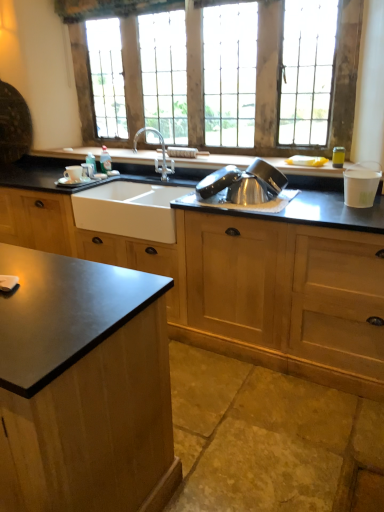
Question: Is matte white cup at sink far away from satin silver bowl at center, acting as the 2th appliance starting from the right?

Choices:
 (A) no
 (B) yes

Answer: (B)

Question: Considering the relative positions of matte white cup at sink and satin silver bowl at center, marked as the first appliance in a left-to-right arrangement, in the image provided, is matte white cup at sink to the left of satin silver bowl at center, marked as the first appliance in a left-to-right arrangement, from the viewer's perspective?

Choices:
 (A) no
 (B) yes

Answer: (B)

Question: From a real-world perspective, is matte white cup at sink beneath satin silver bowl at center, marked as the first appliance in a left-to-right arrangement?

Choices:
 (A) no
 (B) yes

Answer: (B)

Question: Is satin silver bowl at center, acting as the 2th appliance starting from the right, completely or partially inside matte white cup at sink?

Choices:
 (A) no
 (B) yes

Answer: (A)

Question: Could you tell me if matte white cup at sink is turned towards satin silver bowl at center, marked as the first appliance in a left-to-right arrangement?

Choices:
 (A) yes
 (B) no

Answer: (B)

Question: Is the depth of matte white cup at sink less than that of satin silver bowl at center, marked as the first appliance in a left-to-right arrangement?

Choices:
 (A) yes
 (B) no

Answer: (B)

Question: Considering the relative positions of matte black countertop at center and satin silver bowl at center, marked as the first appliance in a left-to-right arrangement, in the image provided, is matte black countertop at center to the right of satin silver bowl at center, marked as the first appliance in a left-to-right arrangement, from the viewer's perspective?

Choices:
 (A) yes
 (B) no

Answer: (B)

Question: Is matte black countertop at center positioned behind satin silver bowl at center, acting as the 2th appliance starting from the right?

Choices:
 (A) no
 (B) yes

Answer: (A)

Question: Does matte black countertop at center contain satin silver bowl at center, acting as the 2th appliance starting from the right?

Choices:
 (A) yes
 (B) no

Answer: (B)

Question: Does matte black countertop at center have a lesser height compared to satin silver bowl at center, marked as the first appliance in a left-to-right arrangement?

Choices:
 (A) no
 (B) yes

Answer: (A)

Question: Is matte black countertop at center thinner than satin silver bowl at center, acting as the 2th appliance starting from the right?

Choices:
 (A) no
 (B) yes

Answer: (A)

Question: From a real-world perspective, does matte black countertop at center stand above satin silver bowl at center, marked as the first appliance in a left-to-right arrangement?

Choices:
 (A) no
 (B) yes

Answer: (A)

Question: Does white matte sink at center appear on the left side of white paper cup at right, which is counted as the 2th appliance, starting from the left?

Choices:
 (A) no
 (B) yes

Answer: (B)